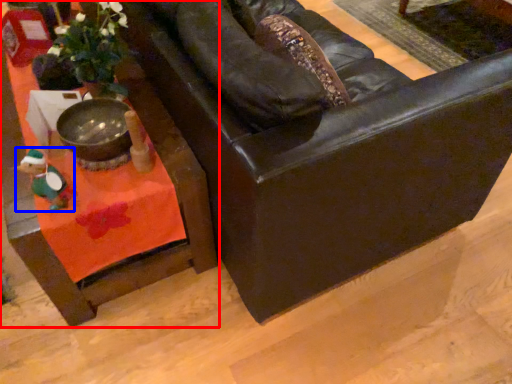
Question: Which point is further to the camera, table (highlighted by a red box) or toy (highlighted by a blue box)?

Choices:
 (A) table
 (B) toy

Answer: (A)